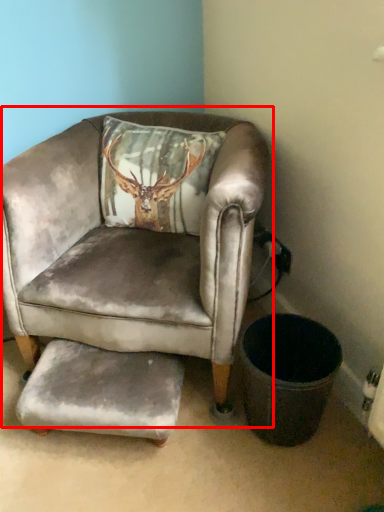
Question: From the image, what is the correct spatial relationship of chair (annotated by the red box) in relation to footrest?

Choices:
 (A) right
 (B) left

Answer: (A)